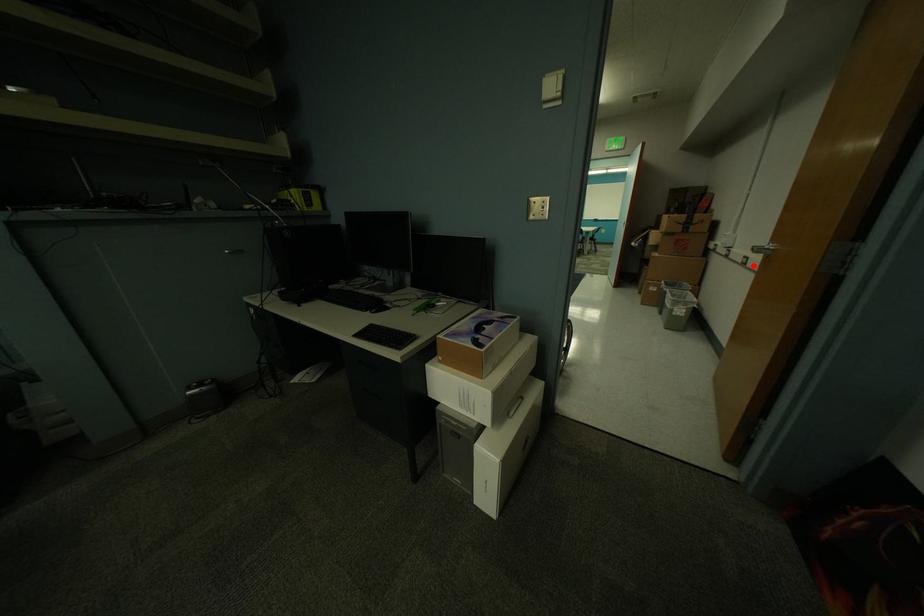
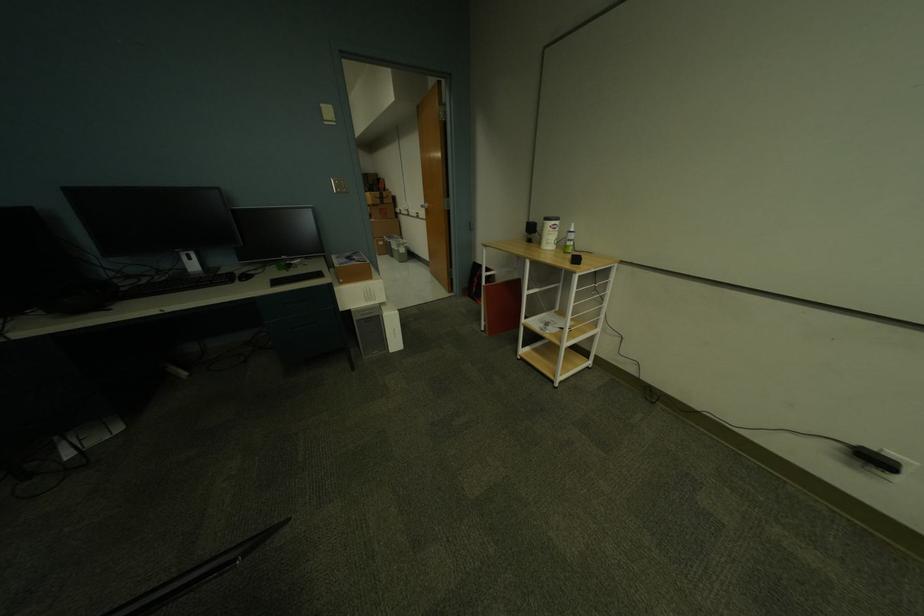
The point at the highlighted location is marked in the first image. Where is the corresponding point in the second image?

(427, 217)